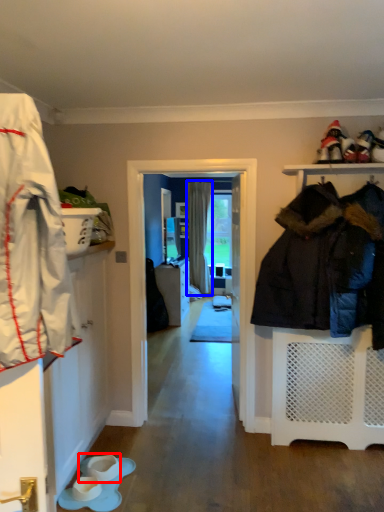
Question: Among these objects, which one is farthest to the camera, footwear (highlighted by a red box) or curtain (highlighted by a blue box)?

Choices:
 (A) footwear
 (B) curtain

Answer: (B)